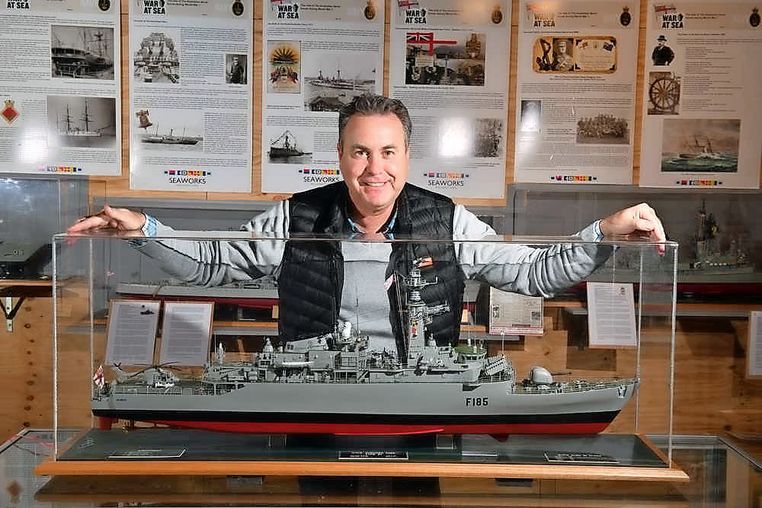
Where is `rightmost poster`? rightmost poster is located at coordinates (754, 345).